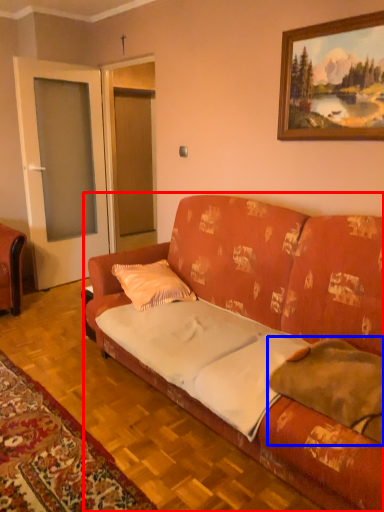
Question: Which object appears farthest to the camera in this image, studio couch (highlighted by a red box) or pillow (highlighted by a blue box)?

Choices:
 (A) studio couch
 (B) pillow

Answer: (B)